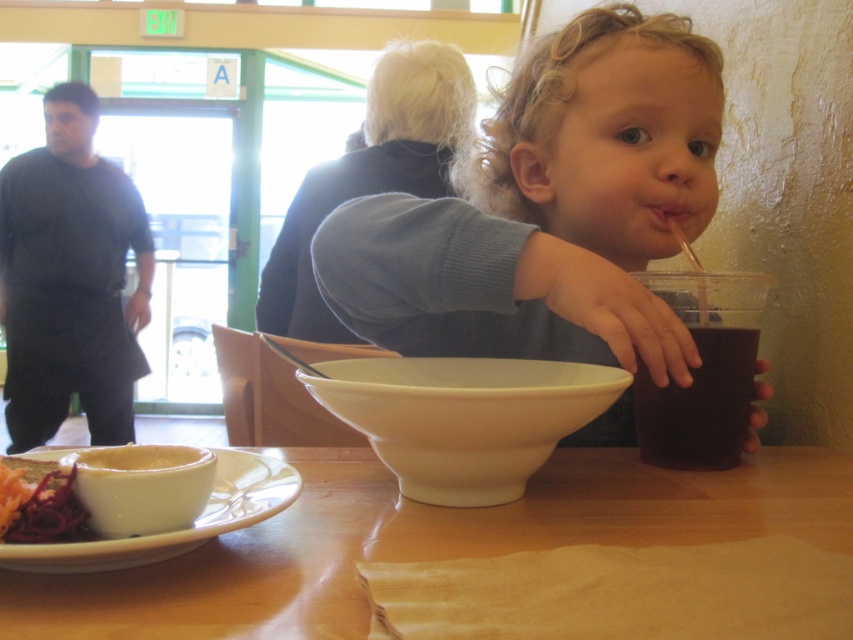
Is point (672, 458) positioned behind point (10, 456)?

Yes, point (672, 458) is behind point (10, 456).

Does dark matte cup at right lie behind shiny red beets at lower left?

Yes, it is.

Between point (724, 428) and point (73, 493), which one is positioned in front?

Point (73, 493) is in front.

Image resolution: width=853 pixels, height=640 pixels. Find the location of `dark matte cup at right`. dark matte cup at right is located at coordinates (699, 401).

Between point (704, 221) and point (30, 291), which one is positioned in front?

Point (704, 221) is in front.

Where is `smooth plastic cup at center`? smooth plastic cup at center is located at coordinates (549, 209).

Where is `smooth plastic cup at center`? smooth plastic cup at center is located at coordinates (549, 209).

Is smooth plastic cup at center to the left of dark matte cup at right from the viewer's perspective?

Indeed, smooth plastic cup at center is positioned on the left side of dark matte cup at right.

Who is more forward, (x=636, y=204) or (x=651, y=413)?

Point (x=651, y=413) is more forward.

Locate an element on the screen. This screenshot has height=640, width=853. smooth plastic cup at center is located at coordinates (549, 209).